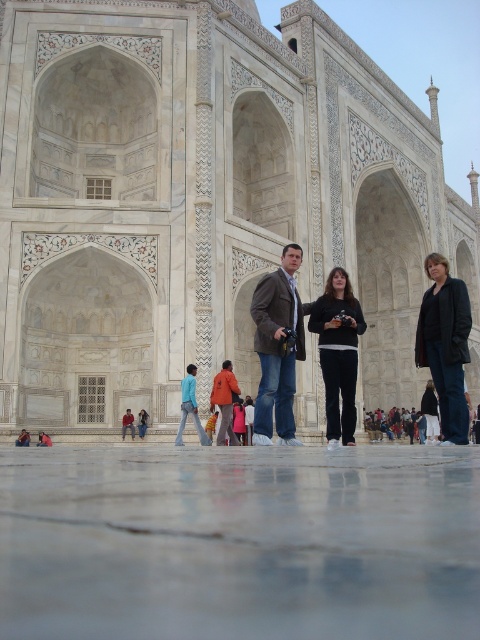
Based on the photo, which is above, white marble palace at center or matte blue jeans at center?

Positioned higher is white marble palace at center.

Looking at this image, can you confirm if white marble palace at center is thinner than matte blue jeans at center?

No.

Between point (264, 202) and point (197, 422), which one is positioned behind?

The point (264, 202) is more distant.

At what (x,y) coordinates should I click in order to perform the action: click on white marble palace at center. Please return your answer as a coordinate pair (x, y). Looking at the image, I should click on (203, 200).

Is matte brown jacket at center thinner than black cotton pants at center?

In fact, matte brown jacket at center might be wider than black cotton pants at center.

Consider the image. Does matte brown jacket at center appear on the left side of black cotton pants at center?

Yes, matte brown jacket at center is to the left of black cotton pants at center.

Measure the distance between point (289, 317) and camera.

Point (289, 317) and camera are 144.30 feet apart from each other.

Where is `matte brown jacket at center`? matte brown jacket at center is located at coordinates (277, 348).

Between point (467, 413) and point (145, 417), which one is positioned behind?

Positioned behind is point (145, 417).

At what (x,y) coordinates should I click in order to perform the action: click on dark blue jeans at right. Please return your answer as a coordinate pair (x, y). The width and height of the screenshot is (480, 640). Looking at the image, I should click on (445, 344).

Where is `dark blue jeans at right`? The image size is (480, 640). dark blue jeans at right is located at coordinates (445, 344).